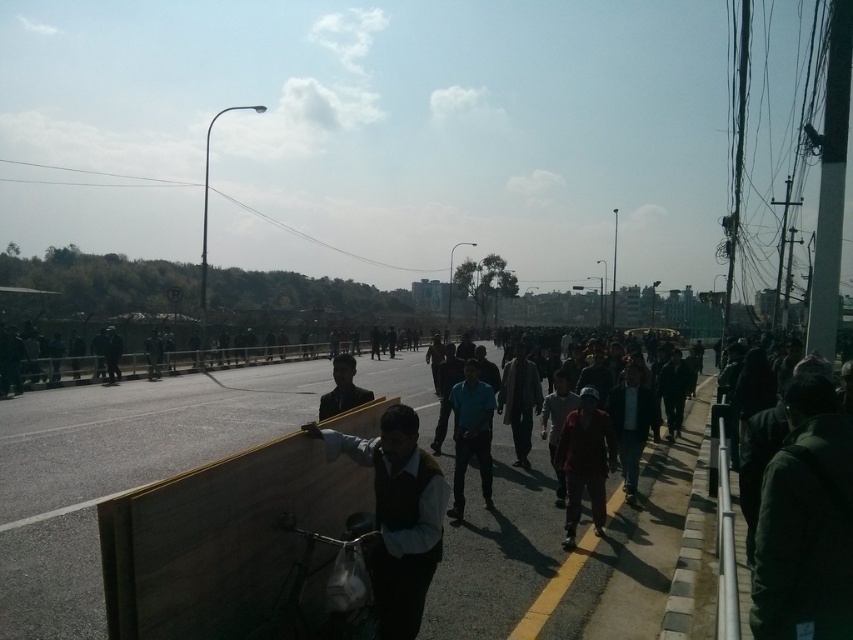
Question: Does dark green jacket at lower right have a smaller size compared to blue matte shirt at center?

Choices:
 (A) no
 (B) yes

Answer: (B)

Question: Which point is closer to the camera taking this photo?

Choices:
 (A) (349, 396)
 (B) (439, 536)
 (C) (805, 531)
 (D) (482, 484)

Answer: (C)

Question: Does wooden plank at center have a lesser width compared to dark green jacket at lower right?

Choices:
 (A) yes
 (B) no

Answer: (B)

Question: From the image, what is the correct spatial relationship of dark green vest at center in relation to blue matte shirt at center?

Choices:
 (A) above
 (B) below

Answer: (A)

Question: Among these objects, which one is farthest from the camera?

Choices:
 (A) dark blue shirt at center
 (B) dark green vest at center

Answer: (A)

Question: Which is nearer to the dark blue shirt at center?

Choices:
 (A) blue matte shirt at center
 (B) wooden plank at center
 (C) dark green vest at center

Answer: (B)